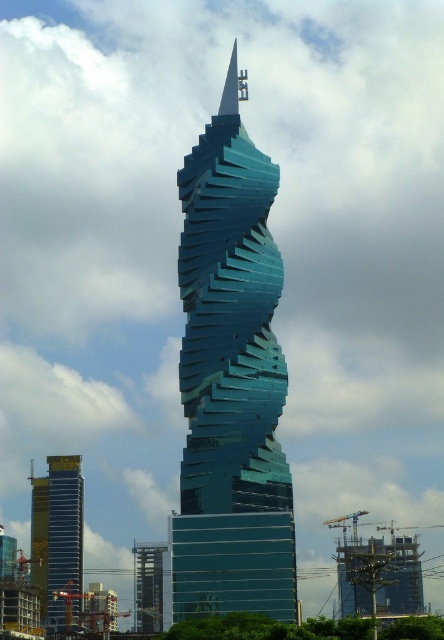
Which is more to the left, glossy glass tower at center or glassy teal skyscraper at center?

From the viewer's perspective, glassy teal skyscraper at center appears more on the left side.

The height and width of the screenshot is (640, 444). I want to click on glossy glass tower at center, so click(x=230, y=381).

Is point (248, 228) less distant than point (159, 625)?

Yes, point (248, 228) is in front of point (159, 625).

Find the location of `glossy glass tower at center`. glossy glass tower at center is located at coordinates (230, 381).

Can you confirm if yellow glass building at left is positioned below glassy teal skyscraper at center?

Incorrect, yellow glass building at left is not positioned below glassy teal skyscraper at center.

From the picture: Who is positioned more to the right, yellow glass building at left or glassy teal skyscraper at center?

glassy teal skyscraper at center is more to the right.

What do you see at coordinates (56, 532) in the screenshot?
I see `yellow glass building at left` at bounding box center [56, 532].

At what (x,y) coordinates should I click in order to perform the action: click on yellow glass building at left. Please return your answer as a coordinate pair (x, y). Looking at the image, I should click on (56, 532).

Is glossy glass tower at center positioned in front of yellow glass building at left?

Yes, it is.

Does glossy glass tower at center lie behind yellow glass building at left?

No, it is not.

Which is behind, point (261, 541) or point (56, 472)?

The point (56, 472) is more distant.

Locate an element on the screen. This screenshot has height=640, width=444. glossy glass tower at center is located at coordinates (230, 381).